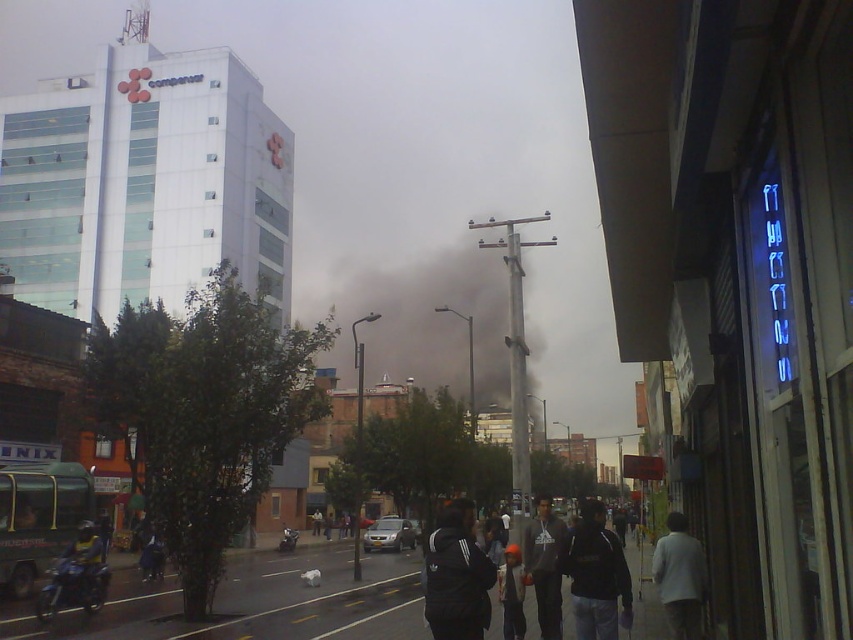
Between black smoke at center and dark gray hoodie at center, which one has less height?

Standing shorter between the two is dark gray hoodie at center.

Does point (448, 250) lie behind point (556, 528)?

Yes, point (448, 250) is farther from viewer.

Identify the location of black smoke at center. This screenshot has width=853, height=640. (430, 321).

Between black smoke at center and black fabric jacket at center, which one is positioned higher?

black smoke at center

Does point (459, 323) come closer to viewer compared to point (486, 608)?

No, (459, 323) is behind (486, 608).

Where is `black smoke at center`? This screenshot has height=640, width=853. black smoke at center is located at coordinates (430, 321).

Who is taller, black fabric jacket at center or black matte jacket at lower center?

black matte jacket at lower center

Can you confirm if black fabric jacket at center is thinner than black matte jacket at lower center?

Indeed, black fabric jacket at center has a lesser width compared to black matte jacket at lower center.

Looking at this image, measure the distance between point (436, 605) and camera.

18.50 feet

The height and width of the screenshot is (640, 853). Identify the location of black fabric jacket at center. (456, 577).